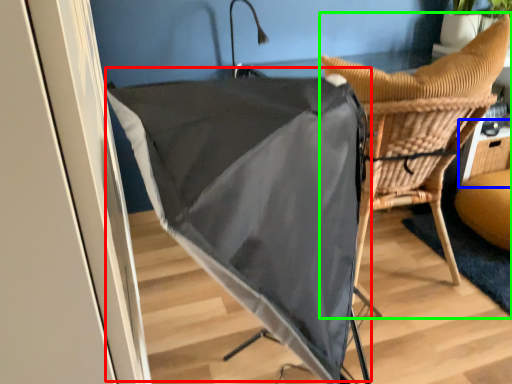
Question: Which object is positioned closest to umbrella (highlighted by a red box)? Select from table (highlighted by a blue box) and chair (highlighted by a green box).

Choices:
 (A) table
 (B) chair

Answer: (B)